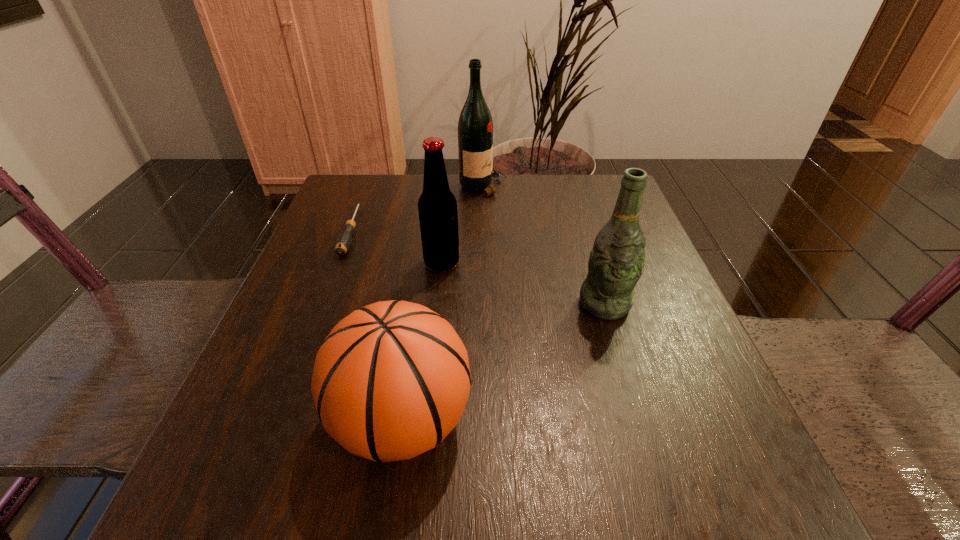
Where is `free spot located on the right of the left beer bottle`? free spot located on the right of the left beer bottle is located at coordinates (596, 263).

The image size is (960, 540). I want to click on vacant space situated 0.290m on the back of the basketball, so click(x=427, y=253).

Locate an element on the screen. The height and width of the screenshot is (540, 960). free spot located 0.190m on the front of the leftmost object is located at coordinates (316, 326).

Where is `wine bottle located at the far edge`? The width and height of the screenshot is (960, 540). wine bottle located at the far edge is located at coordinates point(475,127).

Where is `screwdriver at the far edge`? Image resolution: width=960 pixels, height=540 pixels. screwdriver at the far edge is located at coordinates (344, 240).

You are a GUI agent. You are given a task and a screenshot of the screen. Output one action in this format:
    pyautogui.click(x=<x>, y=<y>)
    Task: Click on the object situated at the near edge
    The width and height of the screenshot is (960, 540).
    Given the screenshot: What is the action you would take?
    pyautogui.click(x=391, y=380)

Locate an element on the screen. This screenshot has width=960, height=540. basketball that is at the left edge is located at coordinates (391, 380).

The height and width of the screenshot is (540, 960). What are the coordinates of `screwdriver present at the left edge` in the screenshot? It's located at (344, 240).

What are the coordinates of `object located in the right edge section of the desktop` in the screenshot? It's located at (616, 261).

This screenshot has height=540, width=960. I want to click on object that is at the far left corner, so click(344, 240).